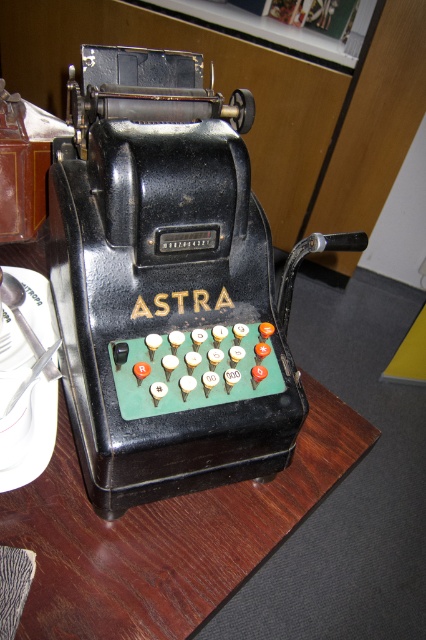
Who is shorter, black matte register at center or white glossy plate at lower left?

With less height is white glossy plate at lower left.

Between point (195, 198) and point (20, 308), which one is positioned behind?

The point (20, 308) is more distant.

Who is more distant from viewer, (x=143, y=444) or (x=2, y=305)?

Point (x=2, y=305)

Identify the location of black matte register at center. The width and height of the screenshot is (426, 640). (169, 284).

Who is lower down, black matte register at center or wooden table at center?

wooden table at center is lower down.

Does black matte register at center have a greater width compared to wooden table at center?

No.

What do you see at coordinates (169, 284) in the screenshot?
I see `black matte register at center` at bounding box center [169, 284].

You are a GUI agent. You are given a task and a screenshot of the screen. Output one action in this format:
    pyautogui.click(x=<x>, y=<y>)
    Task: Click on the black matte register at center
    
    Given the screenshot: What is the action you would take?
    pyautogui.click(x=169, y=284)

Locate an element on the screen. Image resolution: width=426 pixels, height=640 pixels. wooden table at center is located at coordinates (166, 536).

Does wooden table at center appear on the right side of white glossy plate at lower left?

Indeed, wooden table at center is positioned on the right side of white glossy plate at lower left.

This screenshot has height=640, width=426. I want to click on wooden table at center, so click(166, 536).